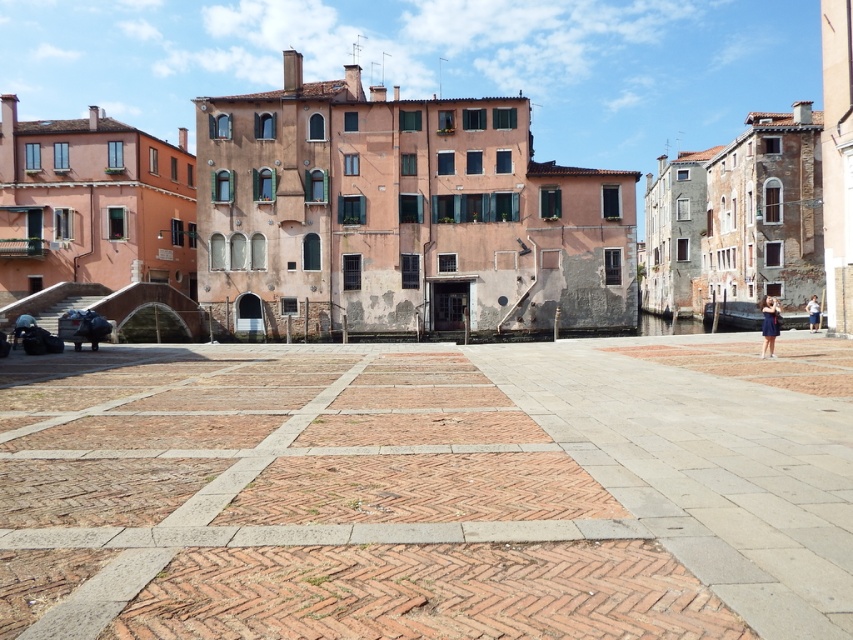
Question: Is brick at center to the left of blue dress at lower right from the viewer's perspective?

Choices:
 (A) yes
 (B) no

Answer: (A)

Question: Does brick at center have a greater width compared to blue dress at lower right?

Choices:
 (A) yes
 (B) no

Answer: (A)

Question: Can you confirm if brick at center is positioned below blue dress at lower right?

Choices:
 (A) yes
 (B) no

Answer: (A)

Question: Which object is positioned closest to the white cotton shirt at center?

Choices:
 (A) blue dress at lower right
 (B) brick at center

Answer: (A)

Question: Among these points, which one is nearest to the camera?

Choices:
 (A) (815, 317)
 (B) (769, 310)

Answer: (B)

Question: Estimate the real-world distances between objects in this image. Which object is farther from the white cotton shirt at center?

Choices:
 (A) blue dress at lower right
 (B) brick at center

Answer: (B)